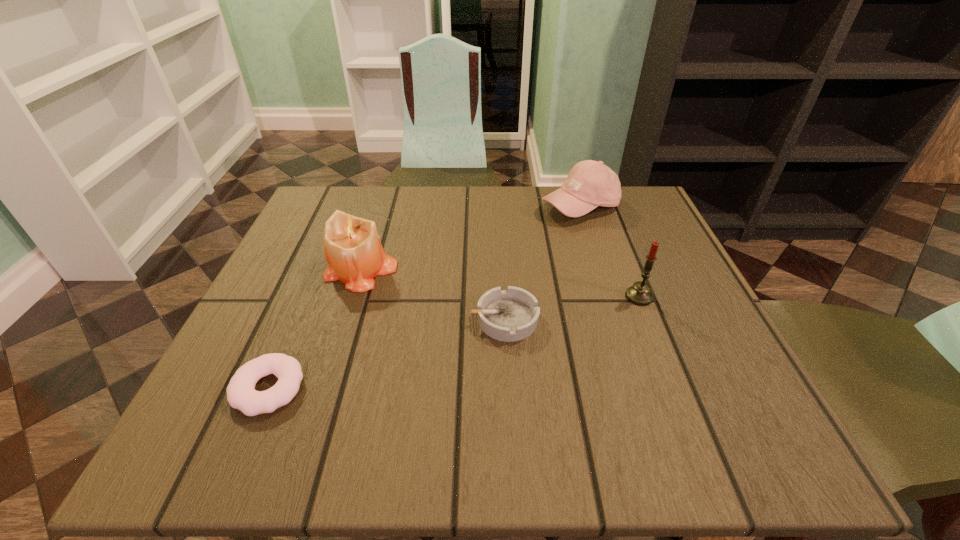
The width and height of the screenshot is (960, 540). What are the coordinates of `vacant space that is in between the left candle and the fourth tallest object` in the screenshot? It's located at (432, 295).

At what (x,y) coordinates should I click in order to perform the action: click on vacant area that lies between the right candle and the left candle. Please return your answer as a coordinate pair (x, y). This screenshot has height=540, width=960. Looking at the image, I should click on (500, 284).

Find the location of `free space between the left candle and the fourth tallest object`. free space between the left candle and the fourth tallest object is located at coordinates point(432,295).

Find the location of `free space between the ashtray and the farthest object`. free space between the ashtray and the farthest object is located at coordinates (542, 263).

The width and height of the screenshot is (960, 540). What are the coordinates of `empty space that is in between the left candle and the third tallest object` in the screenshot? It's located at (470, 239).

At what (x,y) coordinates should I click in order to perform the action: click on free spot between the left candle and the right candle. Please return your answer as a coordinate pair (x, y). The width and height of the screenshot is (960, 540). Looking at the image, I should click on (500, 284).

Identify the location of empty space that is in between the baseball cap and the nearest object. The image size is (960, 540). (424, 298).

The height and width of the screenshot is (540, 960). Find the location of `object that stands as the fourth closest to the nearest object`. object that stands as the fourth closest to the nearest object is located at coordinates (590, 184).

Locate an element on the screen. This screenshot has width=960, height=540. object that is the closest to the shortest object is located at coordinates tap(352, 247).

The image size is (960, 540). What are the coordinates of `vacant area that satisfies the following two spatial constraints: 1. on the front side of the left candle; 2. on the left side of the right candle` in the screenshot? It's located at (352, 296).